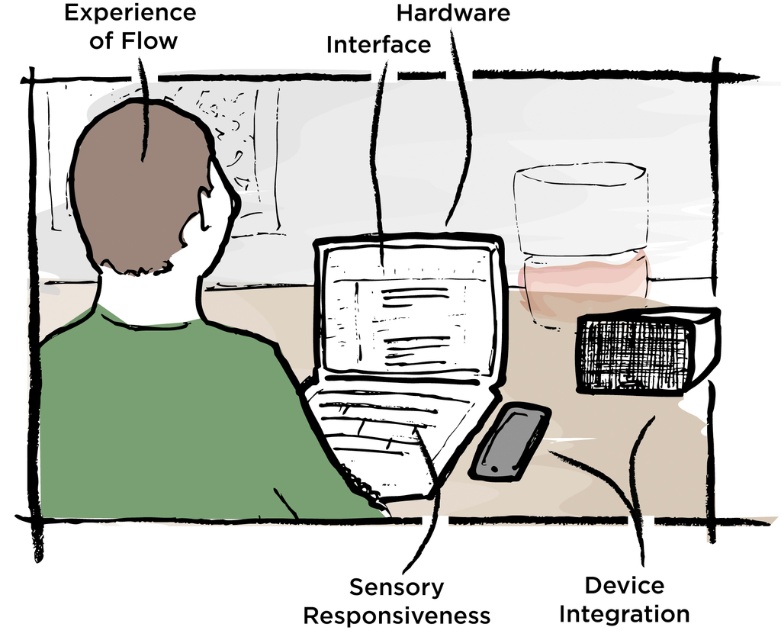
Who is positioned more to the left, matte black laptop at center or green matte shirt at center?

green matte shirt at center is more to the left.

Can you confirm if matte black laptop at center is wider than green matte shirt at center?

Yes.

Identify the location of matte black laptop at center. This screenshot has height=640, width=781. (369, 298).